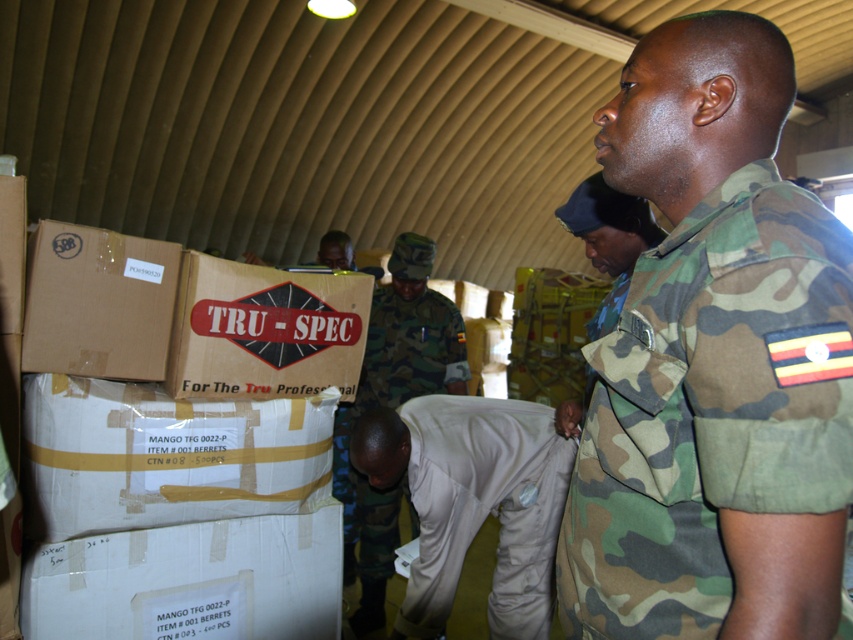
You are an observer in the scene. There are two people wearing camo fabric uniform at center and camo uniform at center. Which one is higher up in the image?

The camo fabric uniform at center is located above the camo uniform at center in the image.

You are a member of the security team positioned at the entrance of the metal structure. You need to deliver a document to the white cardboard box at center. Which direction should you move to reach it?

The white cardboard box at center is located at point (164, 456), so you should move towards the center of the image to reach it.